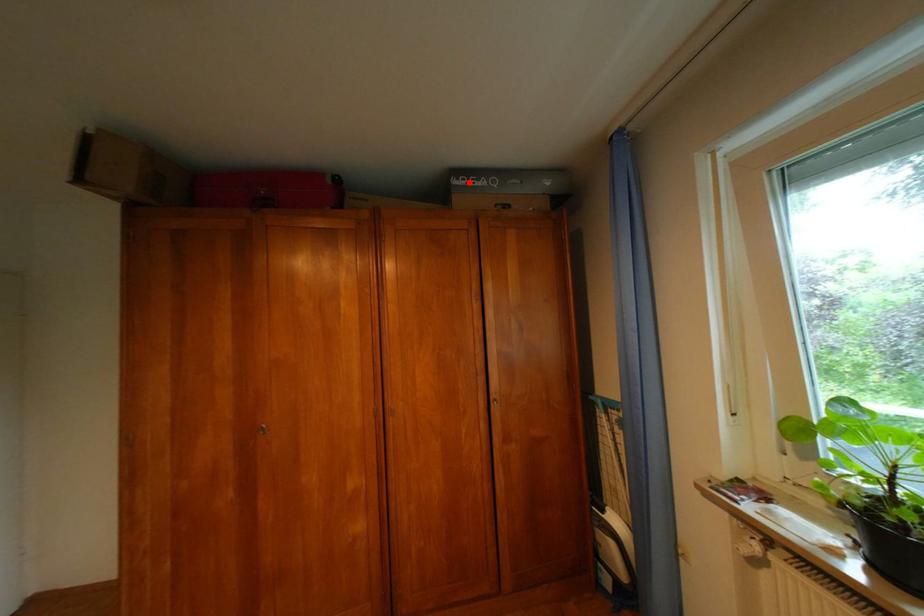
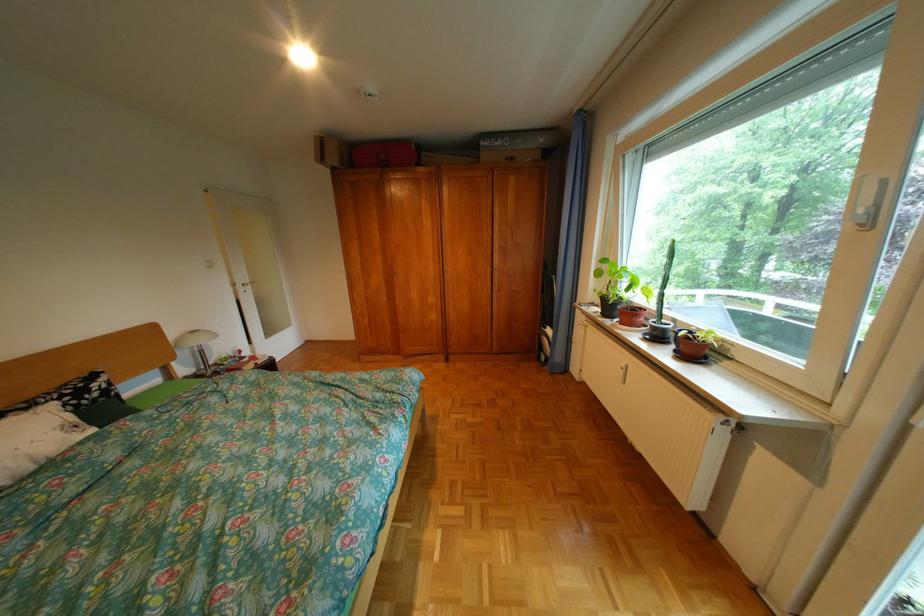
Where in the second image is the point corresponding to the highlighted location from the first image?

(497, 145)